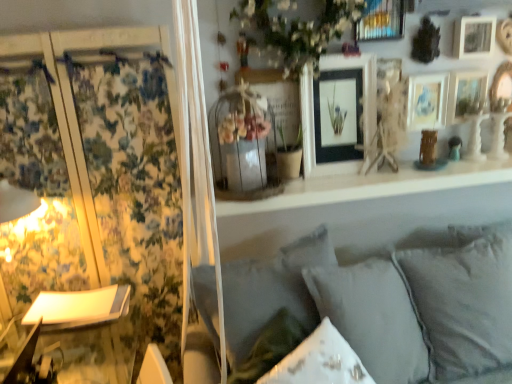
Find the location of `vacant area that lies in front of matte black picture frame at upper center, arranged as the sixth picture frame when viewed from the right`. vacant area that lies in front of matte black picture frame at upper center, arranged as the sixth picture frame when viewed from the right is located at coordinates (345, 185).